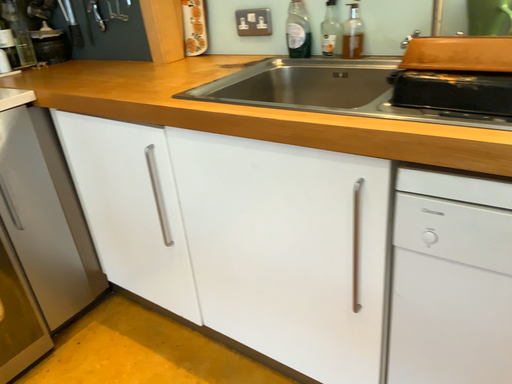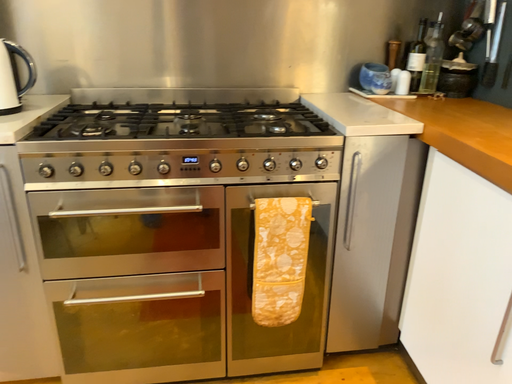
Question: Which way did the camera rotate in the video?

Choices:
 (A) rotated upward
 (B) rotated downward

Answer: (A)